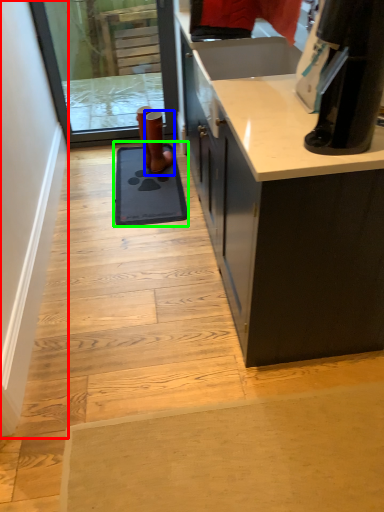
Question: Considering the real-world distances, which object is closest to door (highlighted by a red box)? footwear (highlighted by a blue box) or doormat (highlighted by a green box).

Choices:
 (A) footwear
 (B) doormat

Answer: (B)